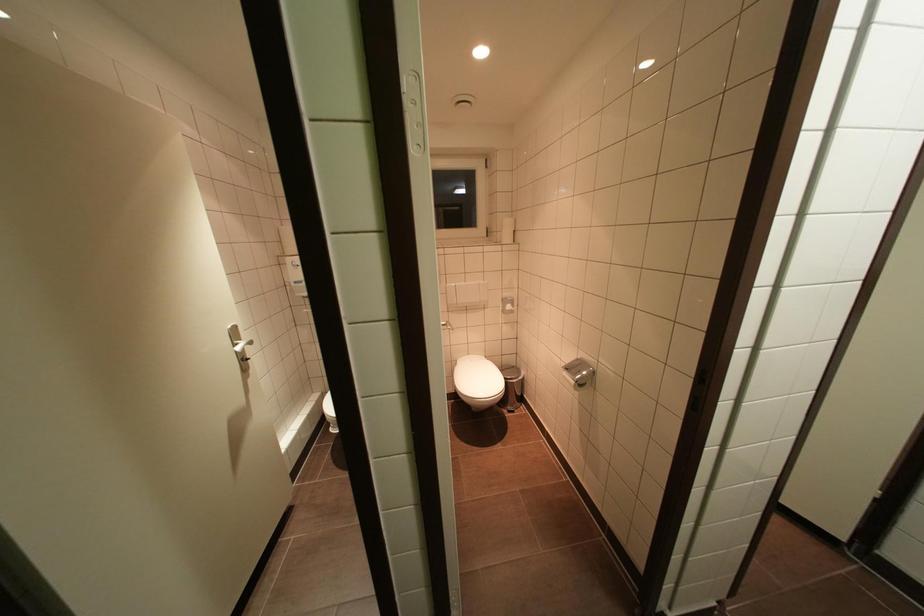
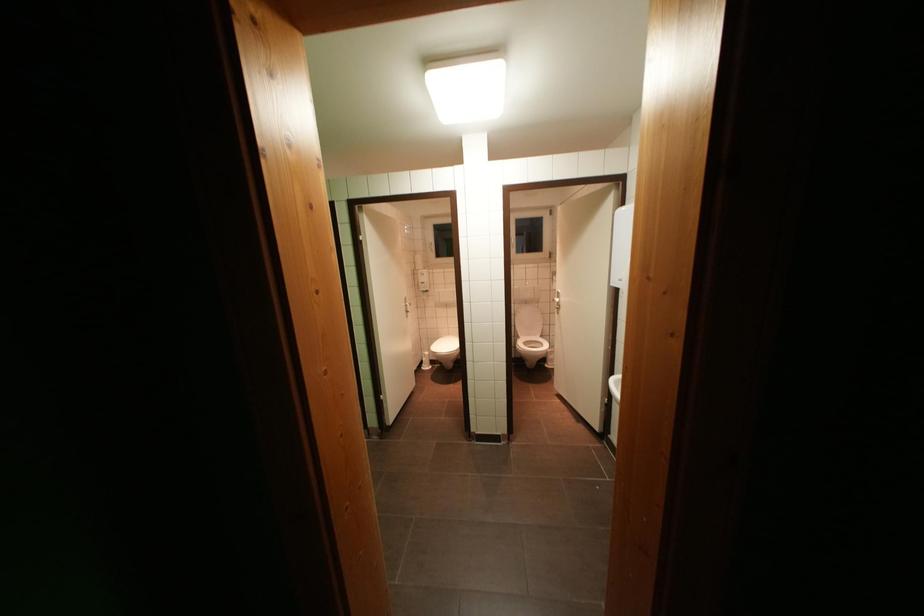
Looking at this image, which direction would the cameraman need to move to produce the second image?

The cameraman moved toward right, backward.